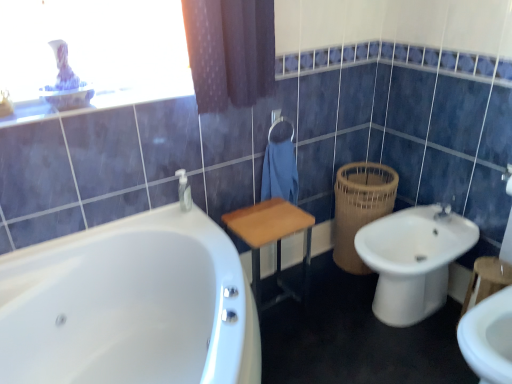
This screenshot has width=512, height=384. I want to click on vacant area that lies between white ceramic bidet at lower right and wooden table at center, so click(x=326, y=309).